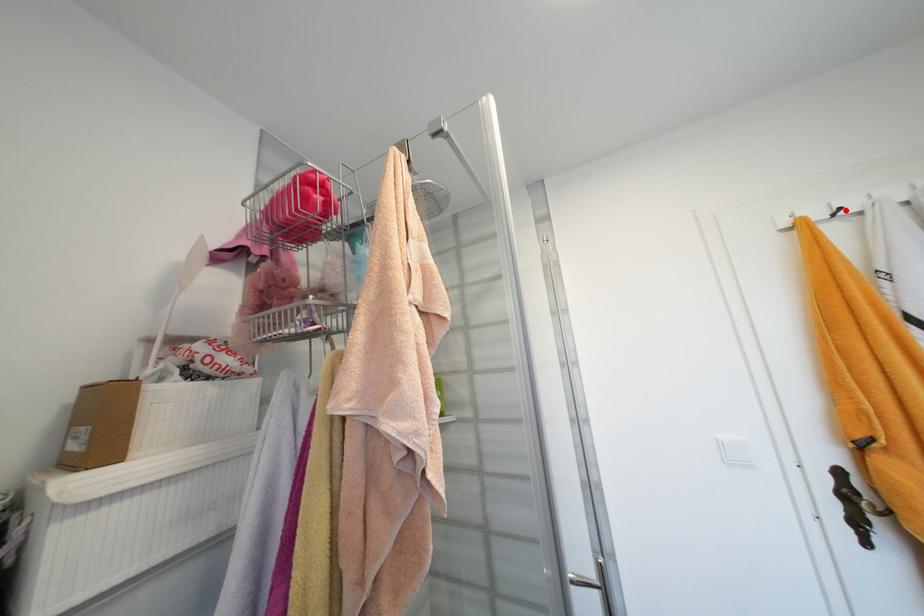
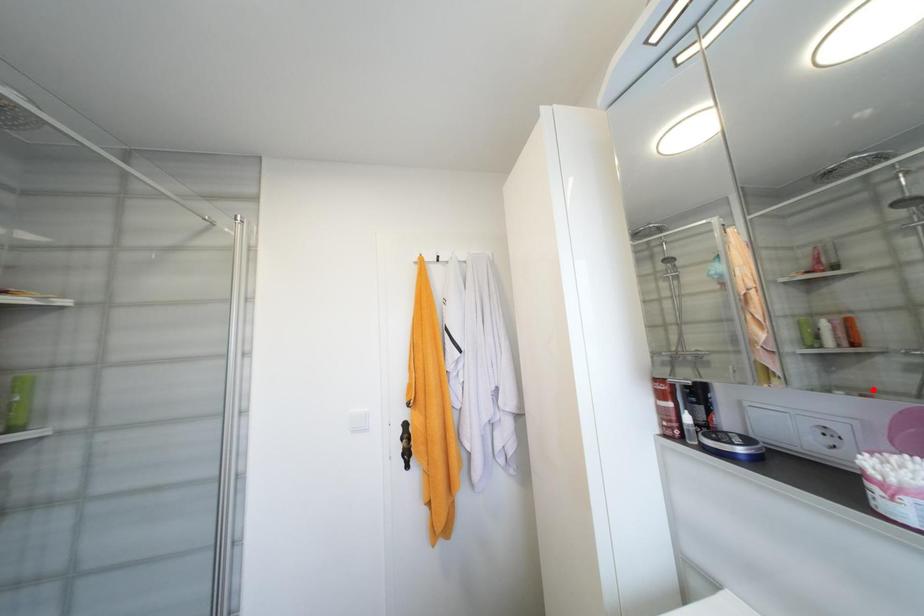
I am providing you with two images of the same scene from different viewpoints. A red point is marked on the first image and another point is marked on the second image. Are the points marked in image1 and image2 representing the same 3D position?

No